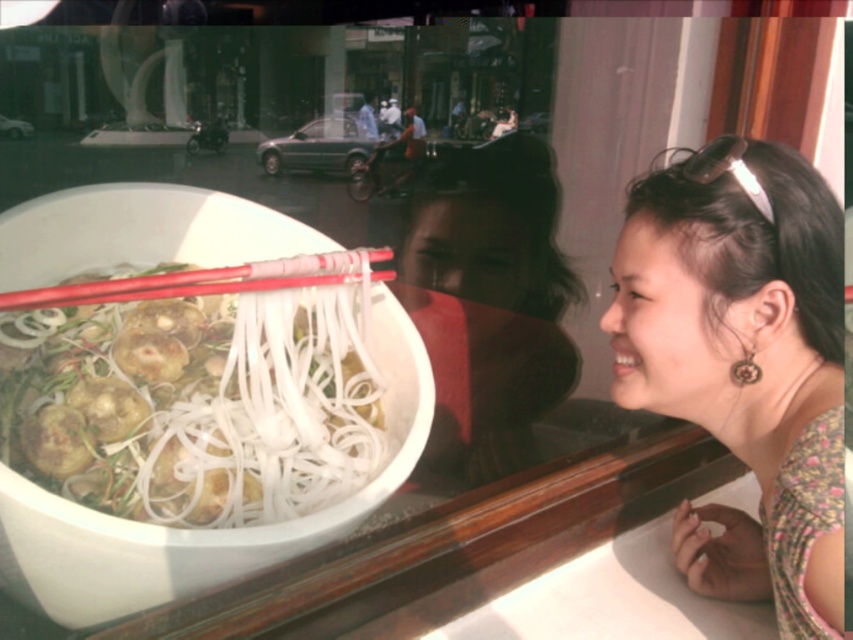
You are a customer at a restaurant and see the white matte noodles at center and the red plastic chopsticks at center on your table. Which object is closer to the left edge of the table?

The white matte noodles at center is positioned on the left side of red plastic chopsticks at center, so the white matte noodles at center is closer to the left edge of the table.

You are a food critic who wants to taste the dish in the image. The chopsticks are standard size. Can you use the red plastic chopsticks at center to pick up the white matte noodles at center without breaking them?

The white matte noodles at center are wider than the red plastic chopsticks at center, so they may be difficult to pick up without breaking since the chopsticks might not fully enclose the noodles.